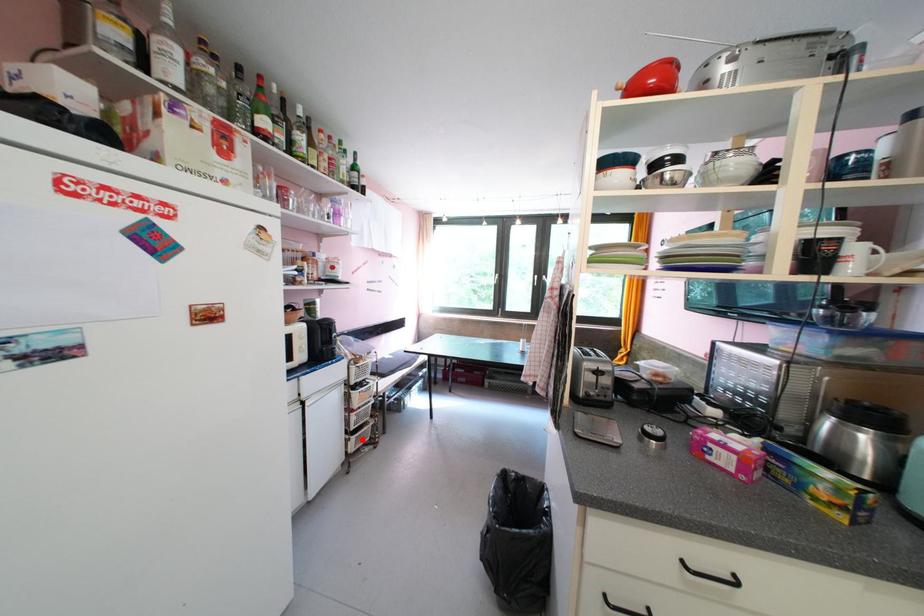
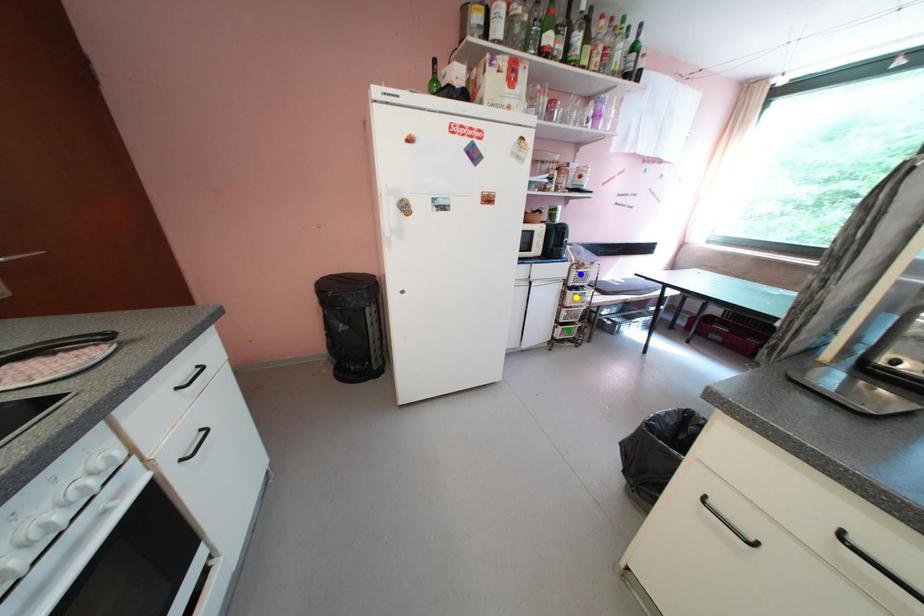
Question: I am providing you with two images of the same scene from different viewpoints. A red point is marked on the first image. You are given multiple points on the second image. In image 2, which mark is for the same physical point as the one in image 1?

Choices:
 (A) yellow point
 (B) blue point
 (C) green point

Answer: (C)